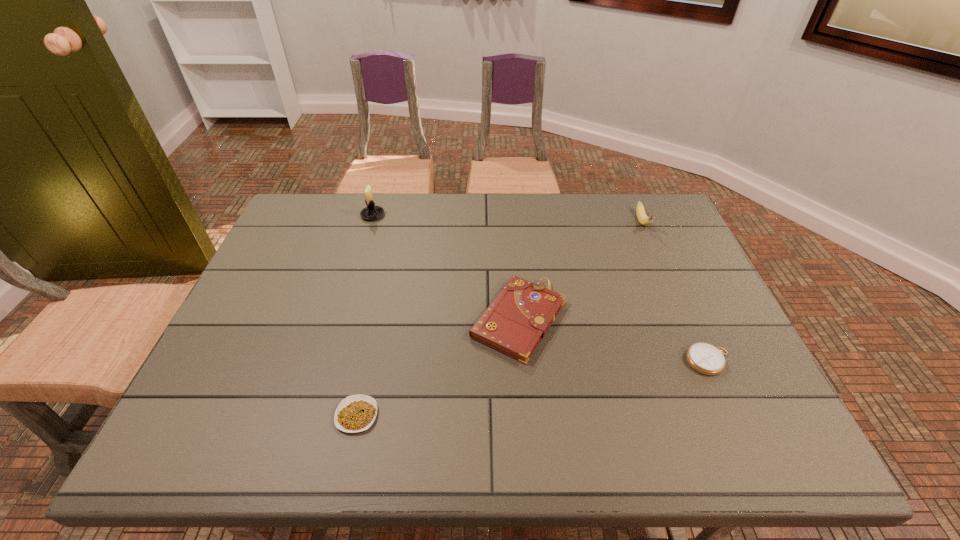
This screenshot has width=960, height=540. In order to click on candle holder in this screenshot , I will do `click(371, 212)`.

I want to click on the leftmost object, so click(x=371, y=212).

The height and width of the screenshot is (540, 960). Identify the location of the second tallest object. (641, 215).

At what (x,y) coordinates should I click in order to perform the action: click on the third tallest object. Please return your answer as a coordinate pair (x, y). This screenshot has height=540, width=960. Looking at the image, I should click on (518, 318).

This screenshot has width=960, height=540. Find the location of `the third object from left to right`. the third object from left to right is located at coordinates (518, 318).

You are a GUI agent. You are given a task and a screenshot of the screen. Output one action in this format:
    pyautogui.click(x=<x>, y=<y>)
    Task: Click on the compass
    This screenshot has width=960, height=540.
    Given the screenshot: What is the action you would take?
    pyautogui.click(x=704, y=358)

Locate an element on the screen. the nearest object is located at coordinates (356, 413).

The image size is (960, 540). In order to click on legume in this screenshot , I will do `click(356, 413)`.

Find the location of a particular element. This screenshot has width=960, height=540. blank space located on the front of the candle holder is located at coordinates (349, 295).

Locate an element on the screen. Image resolution: width=960 pixels, height=540 pixels. vacant region located at the stem of the banana is located at coordinates (664, 272).